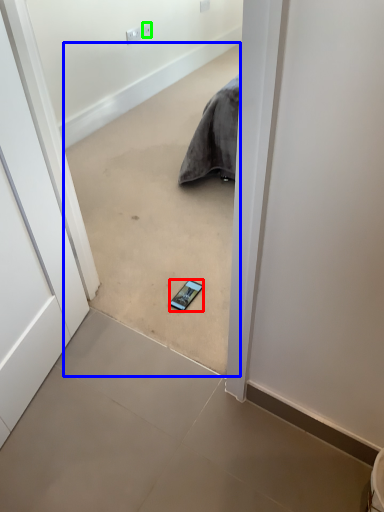
Question: Which is nearer to the smartphone (highlighted by a red box)? concrete (highlighted by a blue box) or electric outlet (highlighted by a green box).

Choices:
 (A) concrete
 (B) electric outlet

Answer: (A)